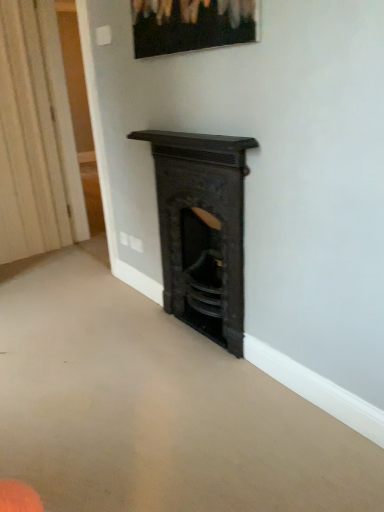
What do you see at coordinates (202, 229) in the screenshot? Image resolution: width=384 pixels, height=512 pixels. I see `black cast iron fireplace at center` at bounding box center [202, 229].

Locate an element on the screen. white textured curtain at left is located at coordinates (36, 137).

I want to click on matte black picture frame at upper center, so click(190, 25).

Is point (234, 9) in front of point (36, 240)?

Yes, point (234, 9) is closer to viewer.

Considering the relative sizes of matte black picture frame at upper center and white textured curtain at left in the image provided, is matte black picture frame at upper center smaller than white textured curtain at left?

Indeed, matte black picture frame at upper center has a smaller size compared to white textured curtain at left.

How many degrees apart are the facing directions of matte black picture frame at upper center and white textured curtain at left?

94.6 degrees separate the facing orientations of matte black picture frame at upper center and white textured curtain at left.

Between matte black picture frame at upper center and white textured curtain at left, which one has larger width?

With larger width is white textured curtain at left.

Is point (57, 177) in front of point (162, 20)?

No, (57, 177) is further to viewer.

Is matte black picture frame at upper center inside white textured curtain at left?

No, white textured curtain at left does not contain matte black picture frame at upper center.

The image size is (384, 512). What are the coordinates of `curtain behind the matte black picture frame at upper center` in the screenshot? It's located at (36, 137).

Could you tell me if white textured curtain at left is facing matte black picture frame at upper center?

Yes, white textured curtain at left is turned towards matte black picture frame at upper center.

Is black cast iron fireplace at center positioned beyond the bounds of matte black picture frame at upper center?

That's correct, black cast iron fireplace at center is outside of matte black picture frame at upper center.

Does black cast iron fireplace at center have a greater width compared to matte black picture frame at upper center?

Indeed, black cast iron fireplace at center has a greater width compared to matte black picture frame at upper center.

Is black cast iron fireplace at center in contact with matte black picture frame at upper center?

No, black cast iron fireplace at center is not beside matte black picture frame at upper center.

How much distance is there between black cast iron fireplace at center and matte black picture frame at upper center?

black cast iron fireplace at center is 65.79 centimeters from matte black picture frame at upper center.

Do you think white textured curtain at left is within black cast iron fireplace at center, or outside of it?

white textured curtain at left is not inside black cast iron fireplace at center, it's outside.

Considering the relative sizes of white textured curtain at left and black cast iron fireplace at center in the image provided, is white textured curtain at left taller than black cast iron fireplace at center?

Indeed, white textured curtain at left has a greater height compared to black cast iron fireplace at center.

Which is in front, point (30, 106) or point (235, 271)?

Point (235, 271)

Where is `fireplace on the right of white textured curtain at left`? This screenshot has width=384, height=512. fireplace on the right of white textured curtain at left is located at coordinates (202, 229).

From the image's perspective, which object appears higher, matte black picture frame at upper center or black cast iron fireplace at center?

From the image's view, matte black picture frame at upper center is above.

Would you say matte black picture frame at upper center is outside black cast iron fireplace at center?

Yes, matte black picture frame at upper center is not within black cast iron fireplace at center.

Is matte black picture frame at upper center closer to camera compared to black cast iron fireplace at center?

Yes.

Is matte black picture frame at upper center at the left side of black cast iron fireplace at center?

Yes.

Is point (166, 311) positioned behind point (45, 132)?

No, it is not.

In the scene shown: Is black cast iron fireplace at center not close to white textured curtain at left?

Yes, black cast iron fireplace at center and white textured curtain at left are located far from each other.

Which of these two, black cast iron fireplace at center or white textured curtain at left, is thinner?

Thinner between the two is white textured curtain at left.

Image resolution: width=384 pixels, height=512 pixels. Identify the location of curtain on the left of the black cast iron fireplace at center. (36, 137).

Locate an element on the screen. Image resolution: width=384 pixels, height=512 pixels. curtain that appears below the matte black picture frame at upper center (from the image's perspective) is located at coordinates (36, 137).

Find the location of a particular element. picture frame that appears above the white textured curtain at left (from a real-world perspective) is located at coordinates pyautogui.click(x=190, y=25).

Looking at the image, which one is located further to black cast iron fireplace at center, matte black picture frame at upper center or white textured curtain at left?

Based on the image, white textured curtain at left appears to be further to black cast iron fireplace at center.

Which object lies further to the anchor point white textured curtain at left, black cast iron fireplace at center or matte black picture frame at upper center?

matte black picture frame at upper center.

Looking at the image, which one is located closer to matte black picture frame at upper center, white textured curtain at left or black cast iron fireplace at center?

black cast iron fireplace at center is closer to matte black picture frame at upper center.

Considering their positions, is black cast iron fireplace at center positioned further to matte black picture frame at upper center than white textured curtain at left?

The object further to matte black picture frame at upper center is white textured curtain at left.

From the image, which object appears to be nearer to black cast iron fireplace at center, white textured curtain at left or matte black picture frame at upper center?

matte black picture frame at upper center is closer to black cast iron fireplace at center.

Looking at the image, which one is located further to white textured curtain at left, matte black picture frame at upper center or black cast iron fireplace at center?

matte black picture frame at upper center is further to white textured curtain at left.

Where is `picture frame situated between white textured curtain at left and black cast iron fireplace at center from left to right`? Image resolution: width=384 pixels, height=512 pixels. picture frame situated between white textured curtain at left and black cast iron fireplace at center from left to right is located at coordinates (190, 25).